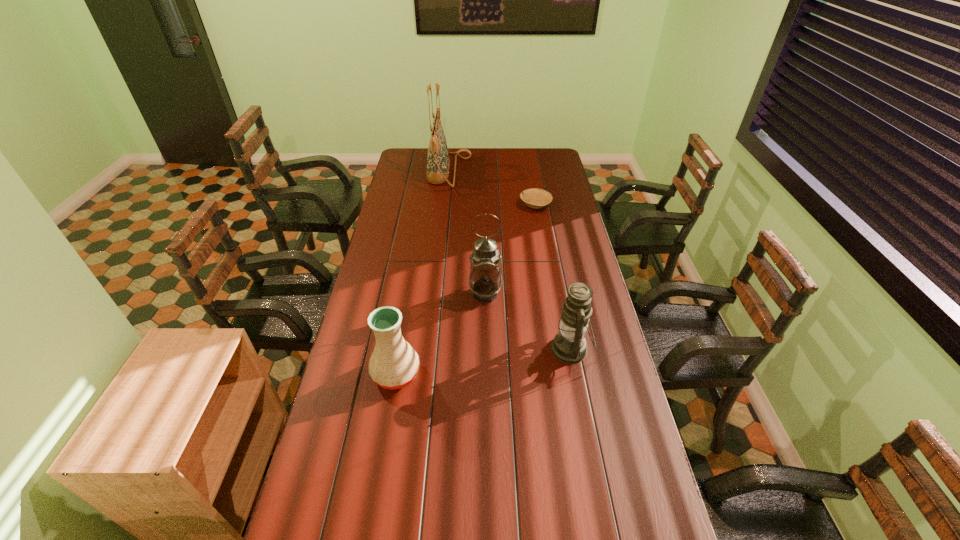
Identify the location of vacant space located on the front of the taller oil lamp. The image size is (960, 540). (486, 349).

Identify the location of free region located 0.060m on the front of the right oil lamp. (578, 388).

Identify the location of free location located 0.390m on the back of the pottery. (413, 276).

Image resolution: width=960 pixels, height=540 pixels. I want to click on free space located on the back of the second farthest object, so click(x=528, y=162).

Find the location of `object at the far edge`. object at the far edge is located at coordinates (438, 163).

Where is `object that is at the left edge`? The width and height of the screenshot is (960, 540). object that is at the left edge is located at coordinates (394, 364).

You are a GUI agent. You are given a task and a screenshot of the screen. Output one action in this format:
    pyautogui.click(x=<x>, y=<y>)
    Task: Click on the oil lamp that is at the right edge
    The height and width of the screenshot is (540, 960).
    Given the screenshot: What is the action you would take?
    pyautogui.click(x=569, y=346)

At what (x,y) coordinates should I click in order to perform the action: click on bowl positioned at the right edge. Please return your answer as a coordinate pair (x, y). The image size is (960, 540). Looking at the image, I should click on (535, 198).

What are the coordinates of `vacant space at the left edge of the desktop` in the screenshot? It's located at (394, 214).

Find the location of a particular element. The width and height of the screenshot is (960, 540). free space at the right edge of the desktop is located at coordinates (556, 199).